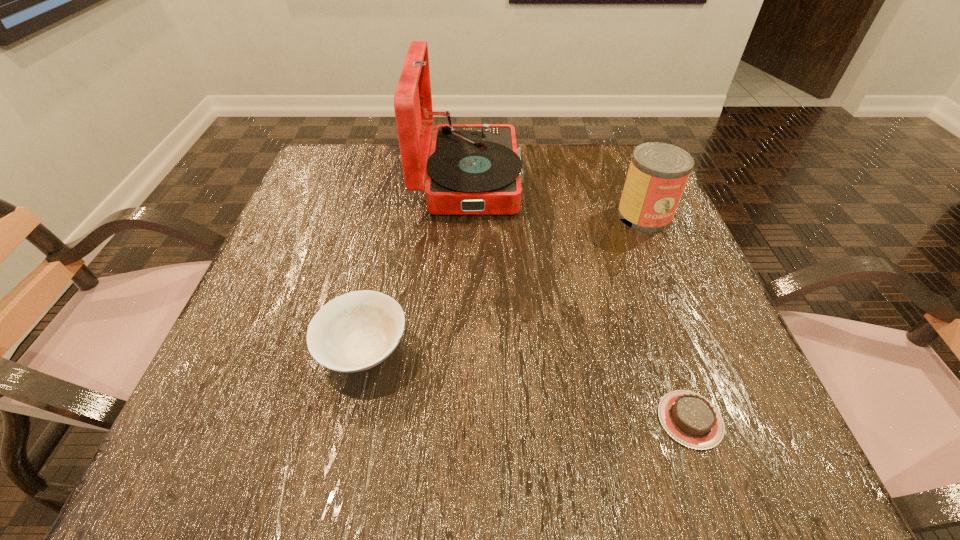
Image resolution: width=960 pixels, height=540 pixels. Find the location of `object situated at the near edge`. object situated at the near edge is located at coordinates (689, 418).

In order to click on object located in the left edge section of the desktop in this screenshot , I will do `click(356, 331)`.

Find the location of a particular element. Image resolution: width=960 pixels, height=540 pixels. can located at the right edge is located at coordinates (658, 173).

At what (x,y) coordinates should I click in order to perform the action: click on chocolate cake situated at the right edge. Please return your answer as a coordinate pair (x, y). Looking at the image, I should click on (689, 418).

Identify the location of object at the far right corner. The image size is (960, 540). (658, 173).

At what (x,y) coordinates should I click in order to perform the action: click on object that is at the near right corner. Please return your answer as a coordinate pair (x, y). This screenshot has width=960, height=540. Looking at the image, I should click on point(689,418).

Find the location of a particular element. The width and height of the screenshot is (960, 540). vacant region at the far edge of the desktop is located at coordinates (383, 174).

In the image, there is a desktop. What are the coordinates of `free space at the near edge` in the screenshot? It's located at (351, 449).

Locate an element on the screen. The image size is (960, 540). vacant space at the left edge is located at coordinates (331, 267).

In the image, there is a desktop. Where is `free space at the right edge`? The image size is (960, 540). free space at the right edge is located at coordinates (633, 303).